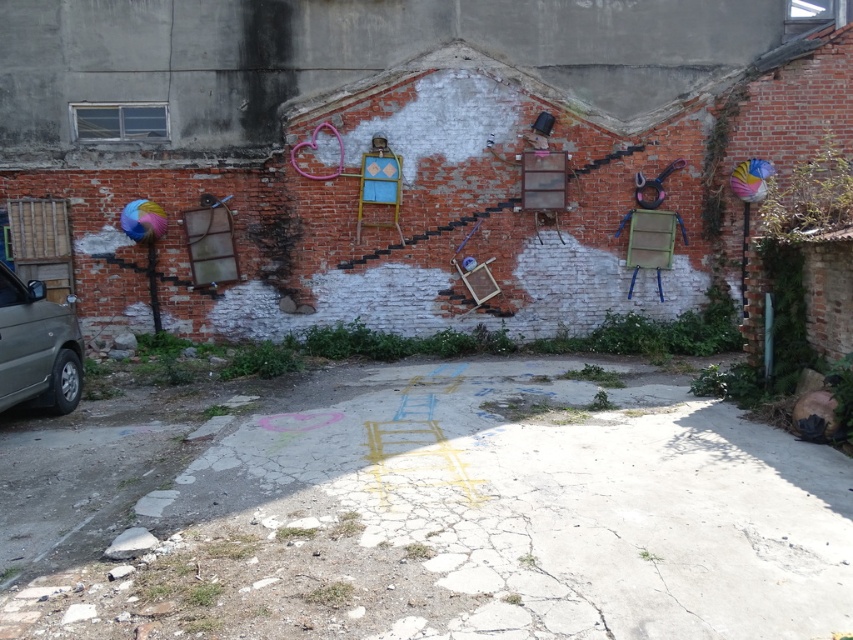
Between cracked concrete ground at center and silver metallic car at left, which one is positioned lower?

cracked concrete ground at center is lower down.

You are a GUI agent. You are given a task and a screenshot of the screen. Output one action in this format:
    pyautogui.click(x=<x>, y=<y>)
    Task: Click on the cracked concrete ground at center
    
    Given the screenshot: What is the action you would take?
    pyautogui.click(x=426, y=512)